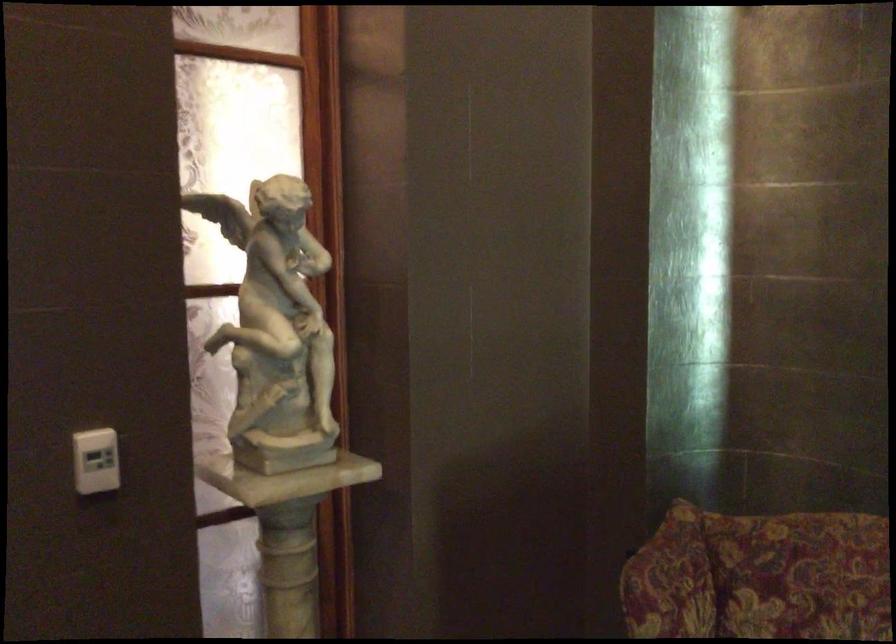
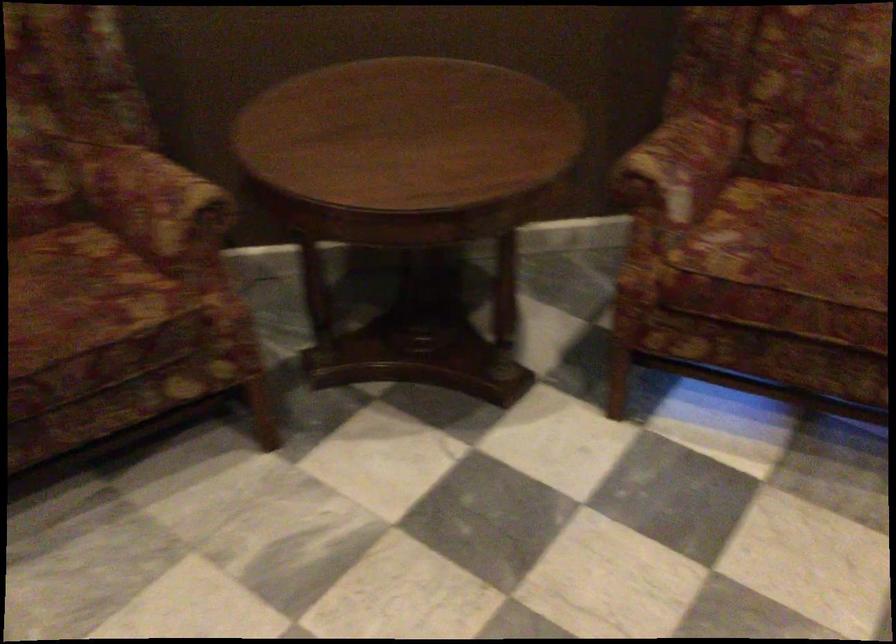
First-person continuous shooting, in which direction is the camera rotating?

The camera rotated toward right-down.